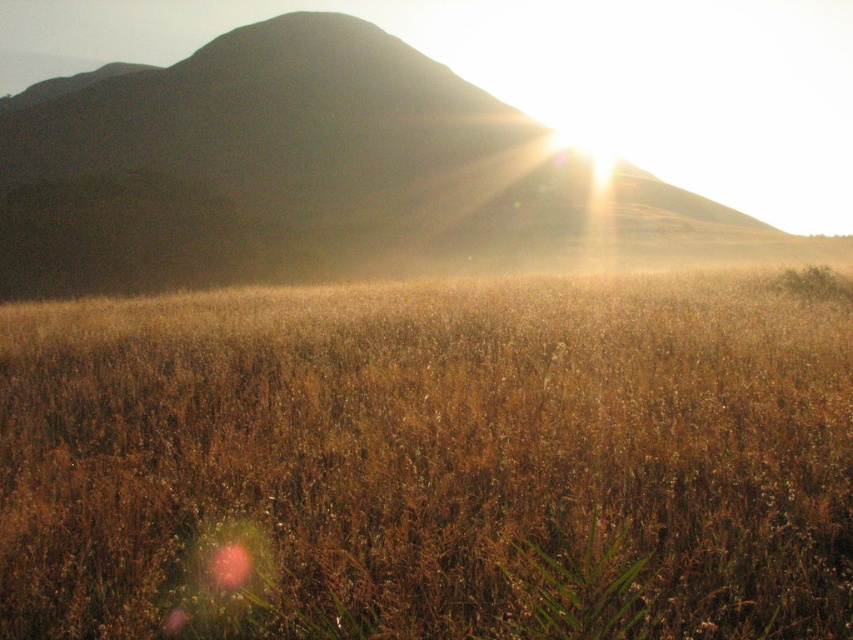
You are a hiker standing on the golden grassy field at center and want to reach the top of the silhouetted rock formation at upper center. Which object is taller, making it harder to climb?

The silhouetted rock formation at upper center is taller than the golden grassy field at center, so it would be harder to climb.